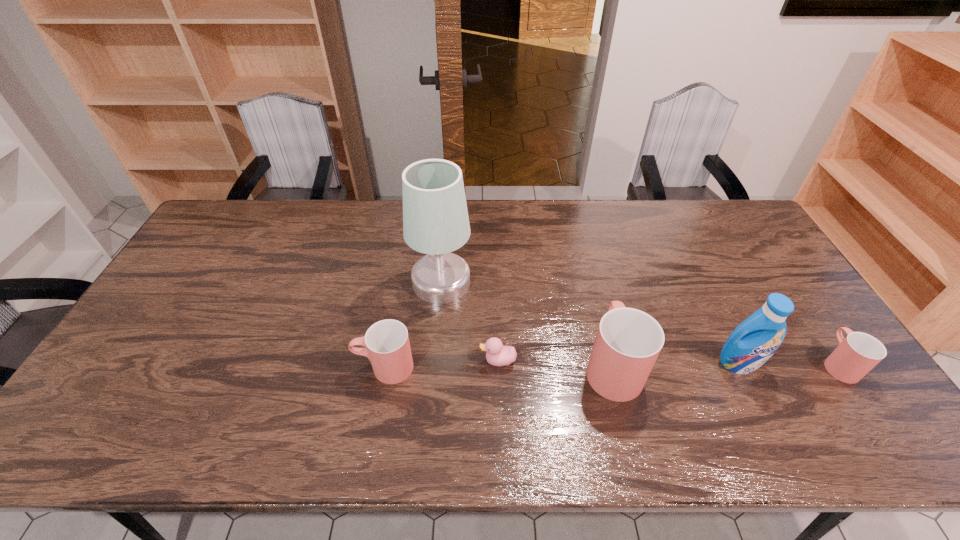
Where is `vacant space that satisfies the following two spatial constraints: 1. on the side of the leftmost cup with the handle; 2. on the side of the shortest cup with the handle`? vacant space that satisfies the following two spatial constraints: 1. on the side of the leftmost cup with the handle; 2. on the side of the shortest cup with the handle is located at coordinates click(385, 363).

Locate an element on the screen. This screenshot has width=960, height=540. vacant space that satisfies the following two spatial constraints: 1. on the side of the second tallest cup with the handle; 2. on the side of the rightmost cup with the handle is located at coordinates (385, 363).

The height and width of the screenshot is (540, 960). In order to click on vacant space that satisfies the following two spatial constraints: 1. on the side of the second cup from left to right with the handle; 2. on the front-facing side of the shortest object in this screenshot , I will do `click(611, 361)`.

You are a GUI agent. You are given a task and a screenshot of the screen. Output one action in this format:
    pyautogui.click(x=<x>, y=<y>)
    Task: Click on the vacant region that satisfies the following two spatial constraints: 1. on the side of the fourth shortest object with the handle; 2. on the front-facing side of the shortest object
    This screenshot has width=960, height=540.
    Given the screenshot: What is the action you would take?
    pyautogui.click(x=611, y=361)

I want to click on vacant point that satisfies the following two spatial constraints: 1. on the front-facing side of the duckling; 2. on the side of the fourth object from left to right with the handle, so click(498, 365).